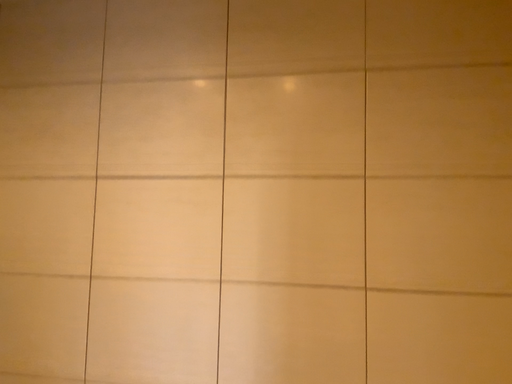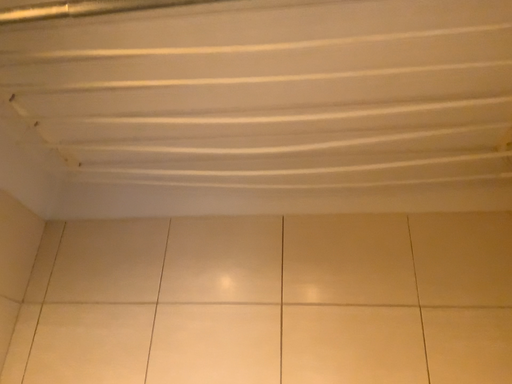
Question: How did the camera likely rotate when shooting the video?

Choices:
 (A) rotated downward
 (B) rotated upward

Answer: (B)